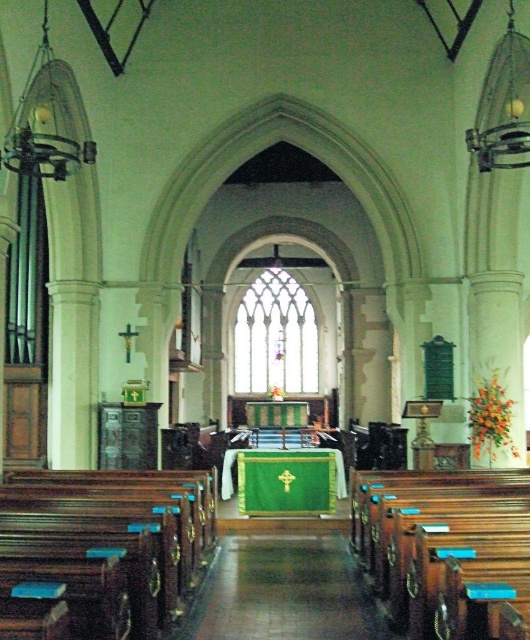
Which of these two, polished dark wood pews at left or shiny polished wood aisle at center, stands shorter?

With less height is shiny polished wood aisle at center.

Who is positioned more to the right, polished dark wood pews at left or shiny polished wood aisle at center?

shiny polished wood aisle at center

Is point (39, 486) farther from viewer compared to point (207, 589)?

No, (39, 486) is closer to viewer.

Locate an element on the screen. polished dark wood pews at left is located at coordinates (107, 547).

Based on the photo, who is higher up, wooden polished pews at lower right or shiny polished wood aisle at center?

wooden polished pews at lower right is above.

Looking at this image, can you confirm if wooden polished pews at lower right is taller than shiny polished wood aisle at center?

Yes.

Locate an element on the screen. The height and width of the screenshot is (640, 530). wooden polished pews at lower right is located at coordinates (443, 547).

Find the location of `wooden polished pews at lower right`. wooden polished pews at lower right is located at coordinates (443, 547).

You are a GUI agent. You are given a task and a screenshot of the screen. Output one action in this format:
    pyautogui.click(x=<x>, y=<y>)
    Task: Click on the polished dark wood pews at left
    
    Given the screenshot: What is the action you would take?
    pyautogui.click(x=107, y=547)

Where is `polished dark wood pews at left`? The height and width of the screenshot is (640, 530). polished dark wood pews at left is located at coordinates (107, 547).